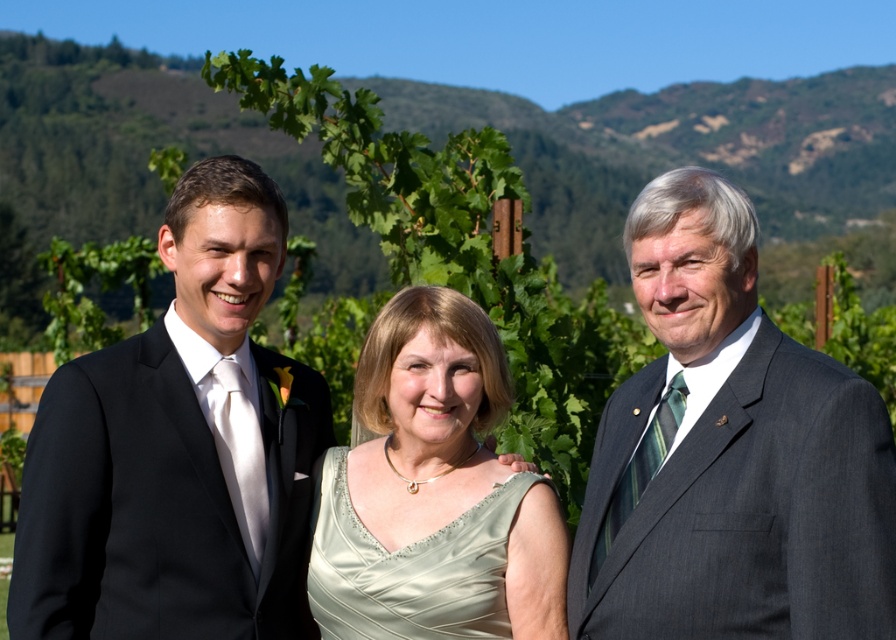
In the scene shown: You are a photographer setting up for a group photo. You want to ensure that both the dark gray suit at right and the black satin suit at left are clearly visible in the frame. Based on their positions, which suit will appear closer to the camera?

The dark gray suit at right appears closer to the camera because it is in front of the black satin suit at left.

You are a photographer setting up for a group photo in a vineyard. You need to position the dark gray suit at right and the black satin suit at left so that both are visible in the frame. Considering their widths, which side should the wider suit be placed to ensure it fits better in the composition?

The black satin suit at left is wider than the dark gray suit at right. To ensure it fits better in the composition, place the black satin suit at left on the side where there is more space or adjust the framing to accommodate its width.